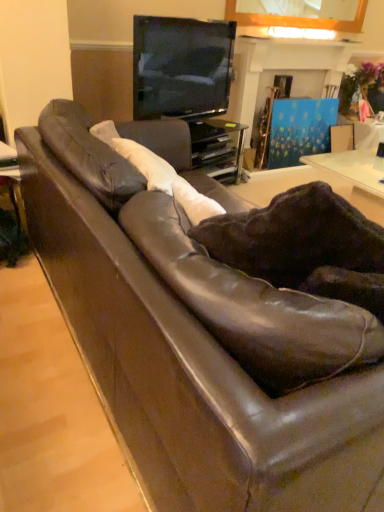
Question: Is black glass entertainment center at upper center spatially inside leather swivel chair at center, or outside of it?

Choices:
 (A) outside
 (B) inside

Answer: (A)

Question: Is point (228, 124) positioned closer to the camera than point (147, 214)?

Choices:
 (A) farther
 (B) closer

Answer: (A)

Question: Which is nearer to the matte brown table at left?

Choices:
 (A) leather swivel chair at center
 (B) matte black tv at upper center
 (C) blue painted wood fireplace at upper center
 (D) black glass entertainment center at upper center

Answer: (B)

Question: Considering the real-world distances, which object is farthest from the matte black tv at upper center?

Choices:
 (A) matte brown table at left
 (B) blue painted wood fireplace at upper center
 (C) leather swivel chair at center
 (D) black glass entertainment center at upper center

Answer: (C)